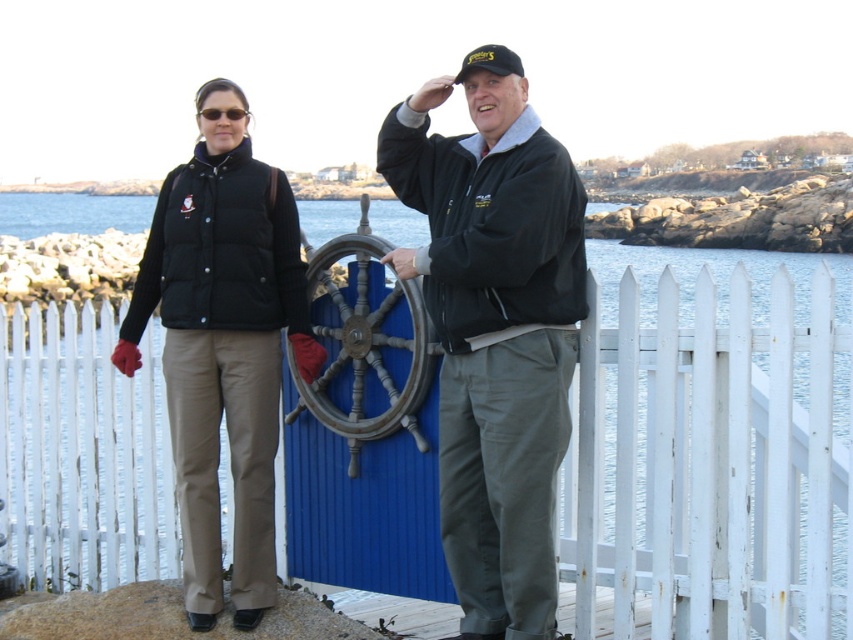
Does matte black vest at center have a greater height compared to wooden ship wheel at center?

Yes.

What do you see at coordinates (495, 330) in the screenshot? Image resolution: width=853 pixels, height=640 pixels. I see `matte black vest at center` at bounding box center [495, 330].

Is point (500, 374) farther from viewer compared to point (363, 326)?

No, (500, 374) is in front of (363, 326).

Locate an element on the screen. This screenshot has height=640, width=853. matte black vest at center is located at coordinates (495, 330).

Based on the photo, who is more distant from viewer, [642,556] or [334,362]?

The point [334,362] is behind.

Is white picket fence at center in front of wooden ship wheel at center?

That is True.

Is point (660, 529) more distant than point (405, 371)?

No.

Find the location of a particular element. This screenshot has width=853, height=640. white picket fence at center is located at coordinates (714, 449).

Does white picket fence at center have a greater width compared to matte black vest at center?

Indeed, white picket fence at center has a greater width compared to matte black vest at center.

Who is more forward, (94, 499) or (485, 180)?

Point (485, 180)

Who is more distant from viewer, (129, 433) or (467, 416)?

Point (129, 433)

You are a GUI agent. You are given a task and a screenshot of the screen. Output one action in this format:
    pyautogui.click(x=<x>, y=<y>)
    Task: Click on the white picket fence at center
    This screenshot has height=640, width=853.
    Given the screenshot: What is the action you would take?
    pyautogui.click(x=714, y=449)